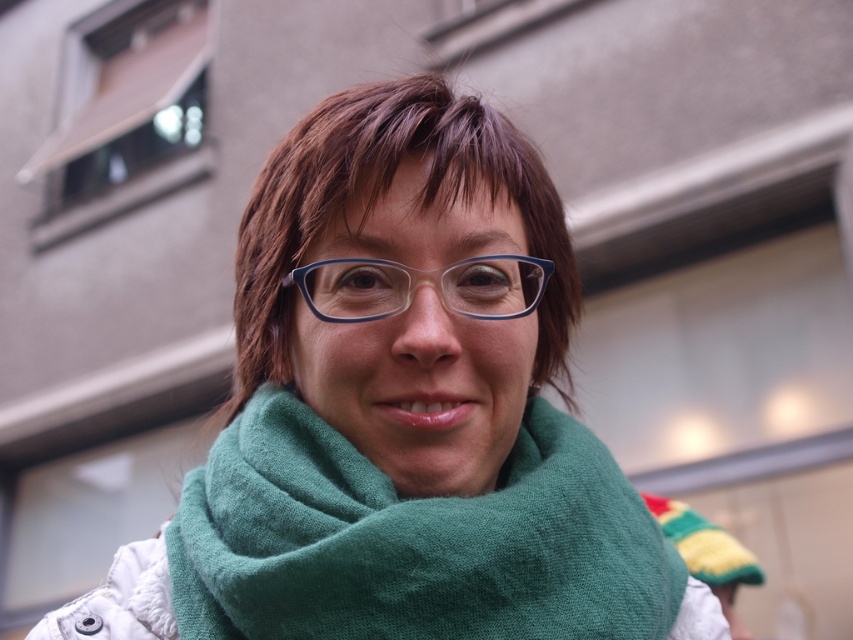
Question: From the image, what is the correct spatial relationship of green woolen scarf at center in relation to transparent blue glasses at center?

Choices:
 (A) left
 (B) right

Answer: (B)

Question: Where is green woolen scarf at center located in relation to transparent blue glasses at center in the image?

Choices:
 (A) below
 (B) above

Answer: (A)

Question: Is green woolen scarf at center to the right of transparent blue glasses at center from the viewer's perspective?

Choices:
 (A) yes
 (B) no

Answer: (A)